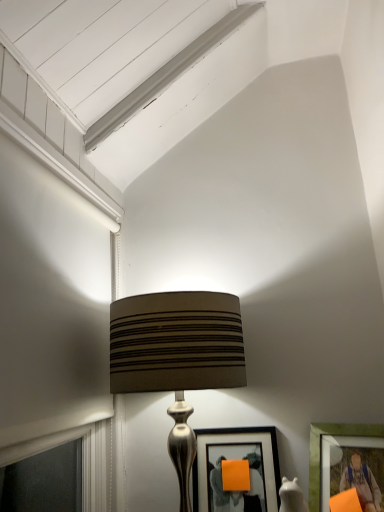
Question: Could you tell me if matte green picture frame at lower right, which is the 1th picture frame from right to left, is turned towards matte brown fabric lampshade at center?

Choices:
 (A) yes
 (B) no

Answer: (B)

Question: Can you confirm if matte green picture frame at lower right, the 2th picture frame viewed from the left, is thinner than matte brown fabric lampshade at center?

Choices:
 (A) yes
 (B) no

Answer: (A)

Question: Can matte brown fabric lampshade at center be found inside matte green picture frame at lower right, the 2th picture frame viewed from the left?

Choices:
 (A) yes
 (B) no

Answer: (B)

Question: Considering the relative positions of matte green picture frame at lower right, which is the 1th picture frame from right to left, and matte brown fabric lampshade at center in the image provided, is matte green picture frame at lower right, which is the 1th picture frame from right to left, to the left of matte brown fabric lampshade at center from the viewer's perspective?

Choices:
 (A) yes
 (B) no

Answer: (B)

Question: Is matte green picture frame at lower right, which is the 1th picture frame from right to left, oriented away from matte brown fabric lampshade at center?

Choices:
 (A) no
 (B) yes

Answer: (A)

Question: Would you say matte green picture frame at lower right, the 2th picture frame viewed from the left, is to the left or to the right of matte brown fabric lampshade at center in the picture?

Choices:
 (A) left
 (B) right

Answer: (B)

Question: Considering the positions of matte green picture frame at lower right, which is the 1th picture frame from right to left, and matte brown fabric lampshade at center in the image, is matte green picture frame at lower right, which is the 1th picture frame from right to left, wider or thinner than matte brown fabric lampshade at center?

Choices:
 (A) wide
 (B) thin

Answer: (B)

Question: Does point (317, 503) appear closer or farther from the camera than point (170, 353)?

Choices:
 (A) closer
 (B) farther

Answer: (B)

Question: Is matte green picture frame at lower right, the 2th picture frame viewed from the left, situated inside matte brown fabric lampshade at center or outside?

Choices:
 (A) inside
 (B) outside

Answer: (B)

Question: Is matte green picture frame at lower right, which is the 1th picture frame from right to left, to the left or to the right of matte black picture frame at center, acting as the second picture frame starting from the right, in the image?

Choices:
 (A) right
 (B) left

Answer: (A)

Question: From a real-world perspective, is matte green picture frame at lower right, the 2th picture frame viewed from the left, above or below matte black picture frame at center, the first picture frame when ordered from left to right?

Choices:
 (A) below
 (B) above

Answer: (B)

Question: Looking at the image, does matte green picture frame at lower right, the 2th picture frame viewed from the left, seem bigger or smaller compared to matte black picture frame at center, the first picture frame when ordered from left to right?

Choices:
 (A) small
 (B) big

Answer: (B)

Question: Is matte green picture frame at lower right, the 2th picture frame viewed from the left, taller or shorter than matte black picture frame at center, acting as the second picture frame starting from the right?

Choices:
 (A) short
 (B) tall

Answer: (A)

Question: Considering the positions of matte brown fabric lampshade at center and matte green picture frame at lower right, the 2th picture frame viewed from the left, in the image, is matte brown fabric lampshade at center taller or shorter than matte green picture frame at lower right, the 2th picture frame viewed from the left,?

Choices:
 (A) short
 (B) tall

Answer: (B)

Question: Does point (148, 315) appear closer or farther from the camera than point (314, 510)?

Choices:
 (A) farther
 (B) closer

Answer: (B)